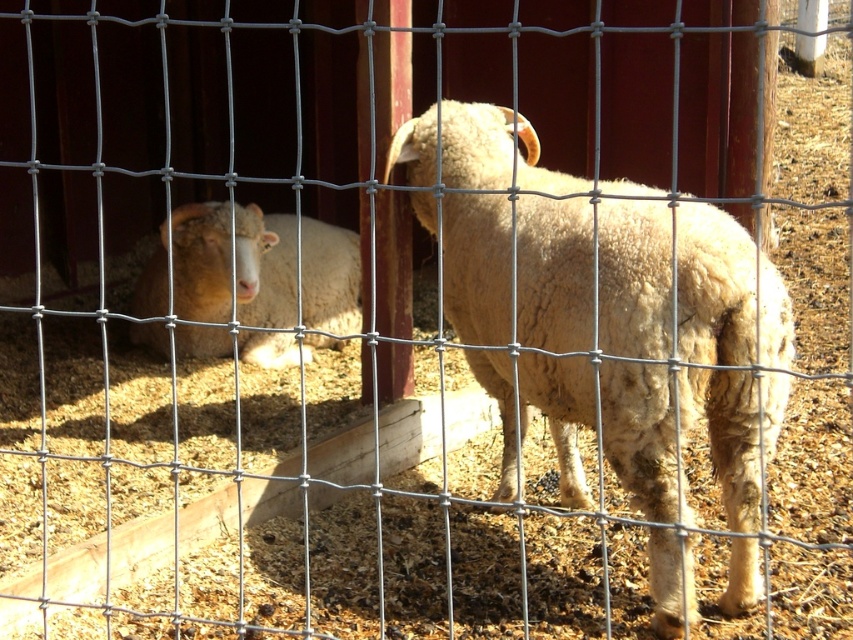
In the scene shown: You are a photographer trying to capture a closeup of the sheep in the fenced enclosure. You notice two points marked in the image. Which point, point (x=549, y=204) or point (x=173, y=237), is closer to your camera lens?

Point (x=549, y=204) is closer to the camera than point (x=173, y=237).

You are a farmer checking the enclosure. You need to move the light beige woolen sheep at center and the fuzzy white sheep at left to separate pens. Which sheep is closer to the bottom of the enclosure?

The light beige woolen sheep at center is located below the fuzzy white sheep at left, so it is closer to the bottom of the enclosure.

You are a farmer who wants to move both the light beige woolen sheep at center and the fuzzy white sheep at left into a smaller pen. Which sheep will require more space due to its size?

The fuzzy white sheep at left requires more space because it has a greater width than the light beige woolen sheep at center.